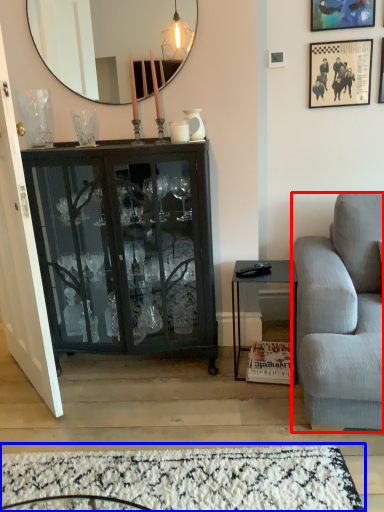
Question: Which point is closer to the camera, studio couch (highlighted by a red box) or plain (highlighted by a blue box)?

Choices:
 (A) studio couch
 (B) plain

Answer: (A)